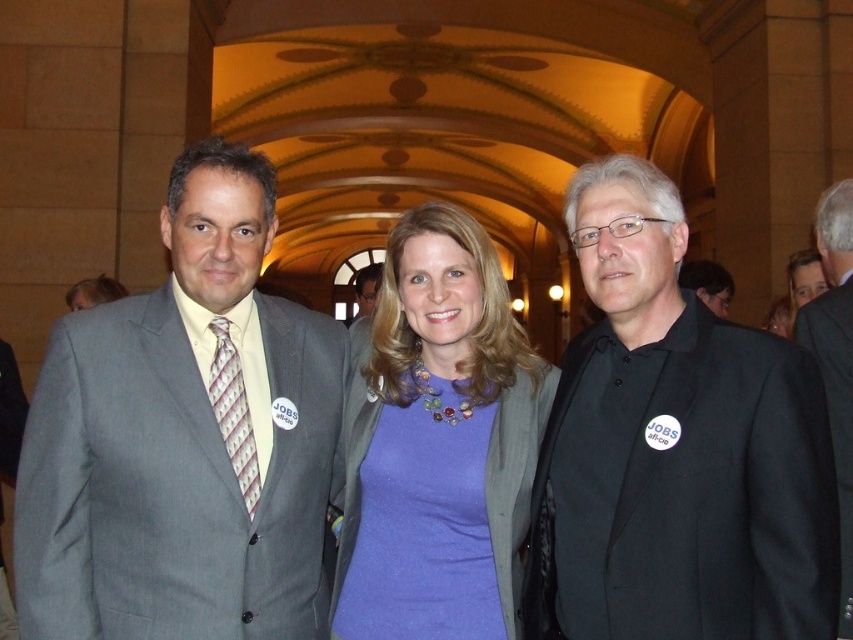
Is matte gray suit at left smaller than matte gray suit at center?

Yes.

Who is higher up, matte gray suit at left or matte gray suit at center?

Positioned higher is matte gray suit at center.

Which is behind, point (268, 492) or point (364, 294)?

The point (364, 294) is more distant.

I want to click on matte gray suit at left, so click(x=184, y=440).

Does black matte shirt at center appear on the left side of black matte suit at center?

Yes, black matte shirt at center is to the left of black matte suit at center.

Is the position of black matte shirt at center more distant than that of black matte suit at center?

No.

Does point (753, 364) come in front of point (717, 288)?

Yes, it is in front of point (717, 288).

Locate an element on the screen. Image resolution: width=853 pixels, height=640 pixels. black matte shirt at center is located at coordinates (675, 451).

Does black matte shirt at center lie behind lavender glittery dress at center?

No, black matte shirt at center is in front of lavender glittery dress at center.

Is black matte shirt at center bigger than lavender glittery dress at center?

Indeed, black matte shirt at center has a larger size compared to lavender glittery dress at center.

Measure the distance between black matte shirt at center and camera.

21.98 meters

Find the location of a particular element. The image size is (853, 640). black matte shirt at center is located at coordinates (675, 451).